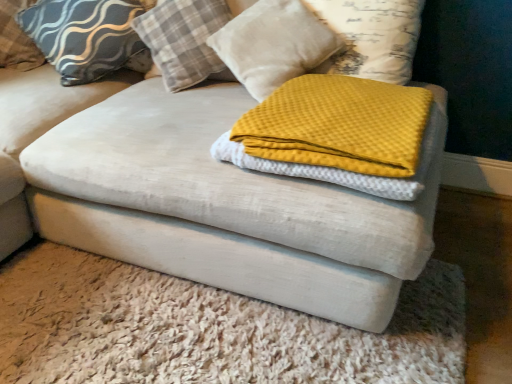
Question: From the image's perspective, is yellow waffle knit blanket at center on velvet ottoman at center?

Choices:
 (A) yes
 (B) no

Answer: (A)

Question: Is yellow waffle knit blanket at center to the right of velvet ottoman at center from the viewer's perspective?

Choices:
 (A) yes
 (B) no

Answer: (A)

Question: Can you confirm if yellow waffle knit blanket at center is taller than velvet ottoman at center?

Choices:
 (A) no
 (B) yes

Answer: (B)

Question: Is yellow waffle knit blanket at center bigger than velvet ottoman at center?

Choices:
 (A) yes
 (B) no

Answer: (B)

Question: Can you confirm if yellow waffle knit blanket at center is positioned to the left of velvet ottoman at center?

Choices:
 (A) no
 (B) yes

Answer: (A)

Question: Would you say matte gray pillow at upper left, the 3th pillow when ordered from right to left, is to the left or to the right of velvet ottoman at center in the picture?

Choices:
 (A) right
 (B) left

Answer: (B)

Question: From the image's perspective, relative to velvet ottoman at center, is matte gray pillow at upper left, the 3th pillow when ordered from right to left, above or below?

Choices:
 (A) below
 (B) above

Answer: (B)

Question: Relative to velvet ottoman at center, is matte gray pillow at upper left, the 3th pillow when ordered from right to left, in front or behind?

Choices:
 (A) behind
 (B) front

Answer: (A)

Question: In terms of width, does matte gray pillow at upper left, the 3th pillow when ordered from right to left, look wider or thinner when compared to velvet ottoman at center?

Choices:
 (A) wide
 (B) thin

Answer: (B)

Question: Considering the positions of textured gray pillow at upper left, which is the first pillow from left to right, and plaid fabric pillow at upper center, marked as the 2th pillow in a right-to-left arrangement, in the image, is textured gray pillow at upper left, which is the first pillow from left to right, wider or thinner than plaid fabric pillow at upper center, marked as the 2th pillow in a right-to-left arrangement,?

Choices:
 (A) thin
 (B) wide

Answer: (A)

Question: Relative to plaid fabric pillow at upper center, marked as the 2th pillow in a right-to-left arrangement, is textured gray pillow at upper left, which is the first pillow from left to right, in front or behind?

Choices:
 (A) front
 (B) behind

Answer: (B)

Question: Which is correct: textured gray pillow at upper left, which is the first pillow from left to right, is inside plaid fabric pillow at upper center, the third pillow viewed from the left, or outside of it?

Choices:
 (A) outside
 (B) inside

Answer: (A)

Question: In terms of size, does textured gray pillow at upper left, which appears as the 4th pillow when viewed from the right, appear bigger or smaller than plaid fabric pillow at upper center, marked as the 2th pillow in a right-to-left arrangement?

Choices:
 (A) big
 (B) small

Answer: (B)

Question: In terms of height, does velvet ottoman at center look taller or shorter compared to plaid fabric pillow at upper center, the third pillow viewed from the left?

Choices:
 (A) short
 (B) tall

Answer: (A)

Question: From the image's perspective, is velvet ottoman at center above or below plaid fabric pillow at upper center, marked as the 2th pillow in a right-to-left arrangement?

Choices:
 (A) below
 (B) above

Answer: (A)